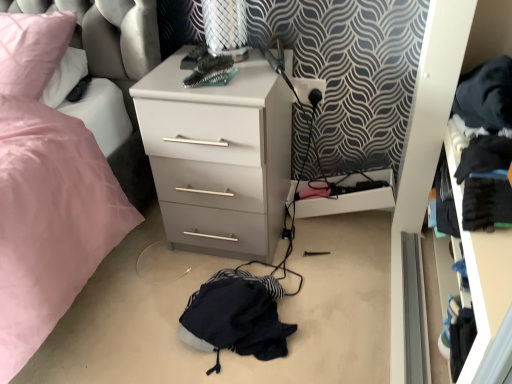
Question: From a real-world perspective, is dark blue fabric at center physically below pink fabric swivel chair at upper left?

Choices:
 (A) no
 (B) yes

Answer: (B)

Question: From the image's perspective, is dark blue fabric at center located above pink fabric swivel chair at upper left?

Choices:
 (A) no
 (B) yes

Answer: (A)

Question: From a real-world perspective, is dark blue fabric at center over pink fabric swivel chair at upper left?

Choices:
 (A) no
 (B) yes

Answer: (A)

Question: Is dark blue fabric at center beside pink fabric swivel chair at upper left?

Choices:
 (A) yes
 (B) no

Answer: (B)

Question: Can we say dark blue fabric at center lies outside pink fabric swivel chair at upper left?

Choices:
 (A) no
 (B) yes

Answer: (B)

Question: Would you say matte gray chest of drawers at center is inside or outside pink fabric swivel chair at upper left?

Choices:
 (A) outside
 (B) inside

Answer: (A)

Question: Considering the relative positions of matte gray chest of drawers at center and pink fabric swivel chair at upper left in the image provided, is matte gray chest of drawers at center to the left or to the right of pink fabric swivel chair at upper left?

Choices:
 (A) right
 (B) left

Answer: (A)

Question: In terms of width, does matte gray chest of drawers at center look wider or thinner when compared to pink fabric swivel chair at upper left?

Choices:
 (A) thin
 (B) wide

Answer: (B)

Question: From a real-world perspective, relative to pink fabric swivel chair at upper left, is matte gray chest of drawers at center vertically above or below?

Choices:
 (A) below
 (B) above

Answer: (A)

Question: Considering their positions, is black plastic electric outlet at upper right located in front of or behind black fabric drawer at right?

Choices:
 (A) behind
 (B) front

Answer: (A)

Question: From the image's perspective, relative to black fabric drawer at right, is black plastic electric outlet at upper right above or below?

Choices:
 (A) above
 (B) below

Answer: (A)

Question: Is black plastic electric outlet at upper right bigger or smaller than black fabric drawer at right?

Choices:
 (A) small
 (B) big

Answer: (A)

Question: Considering the relative positions of black plastic electric outlet at upper right and black fabric drawer at right in the image provided, is black plastic electric outlet at upper right to the left or to the right of black fabric drawer at right?

Choices:
 (A) left
 (B) right

Answer: (A)

Question: Choose the correct answer: Is white plastic drawer at lower center inside pink fabric swivel chair at upper left or outside it?

Choices:
 (A) outside
 (B) inside

Answer: (A)

Question: In terms of width, does white plastic drawer at lower center look wider or thinner when compared to pink fabric swivel chair at upper left?

Choices:
 (A) thin
 (B) wide

Answer: (A)